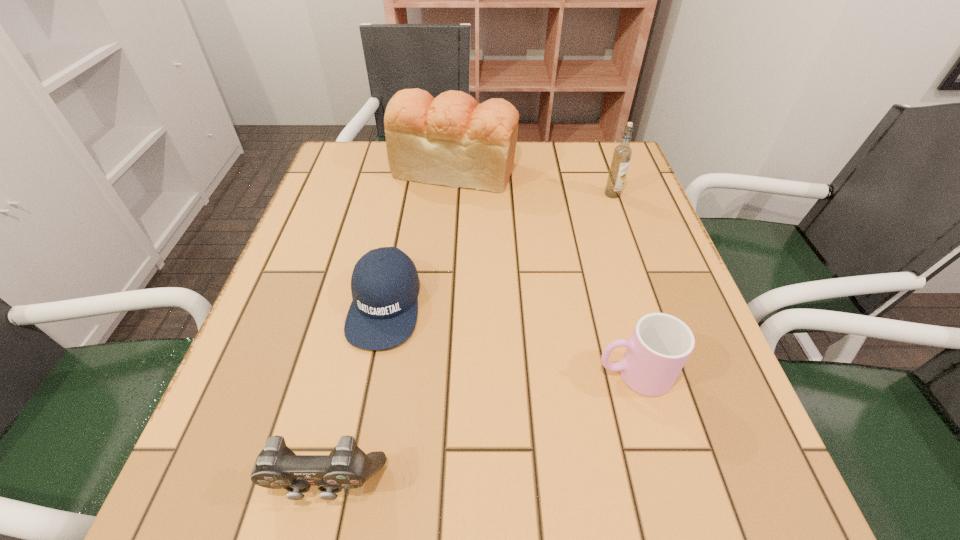
Find the location of a particular element. The height and width of the screenshot is (540, 960). vacant position at the right edge of the desktop is located at coordinates (629, 191).

Identify the location of vacant space at the far left corner of the desktop. This screenshot has width=960, height=540. (365, 188).

Where is `vacant space at the far right corner`? vacant space at the far right corner is located at coordinates (635, 188).

Locate an element on the screen. vacant space in between the vodka and the bread is located at coordinates (534, 181).

Where is `empty location between the cup and the vodka`? The image size is (960, 540). empty location between the cup and the vodka is located at coordinates (623, 284).

I want to click on blank region between the fourth farthest object and the control, so click(479, 428).

Find the location of a particular element. The width and height of the screenshot is (960, 540). free space between the bread and the shortest object is located at coordinates (x=420, y=237).

The height and width of the screenshot is (540, 960). I want to click on blank region between the fourth farthest object and the bread, so click(x=544, y=272).

This screenshot has width=960, height=540. Identify the location of free space between the baseball cap and the fourth farthest object. (509, 339).

Locate an element on the screen. This screenshot has height=540, width=960. vacant space in between the control and the vodka is located at coordinates (468, 338).